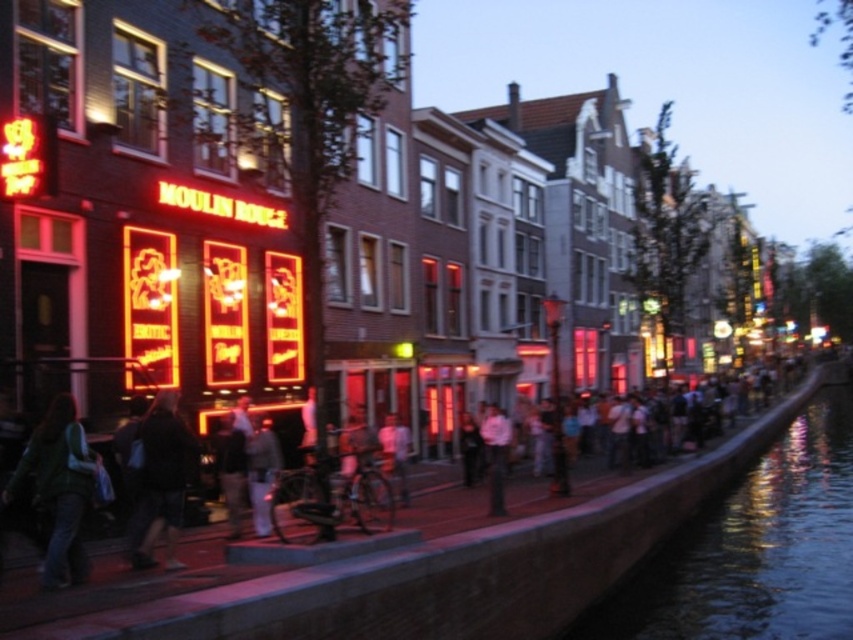
Who is positioned more to the left, dark blue liquid at lower right or dark gray jacket at center?

dark gray jacket at center is more to the left.

Is dark blue liquid at lower right closer to the viewer compared to dark gray jacket at center?

No.

What do you see at coordinates (753, 548) in the screenshot? I see `dark blue liquid at lower right` at bounding box center [753, 548].

Locate an element on the screen. dark blue liquid at lower right is located at coordinates (753, 548).

Can you confirm if dark blue liquid at lower right is taller than green fabric jacket at lower left?

In fact, dark blue liquid at lower right may be shorter than green fabric jacket at lower left.

Which is behind, point (845, 552) or point (61, 563)?

The point (845, 552) is behind.

Is point (740, 570) positioned behind point (54, 586)?

That is True.

What are the coordinates of `dark blue liquid at lower right` in the screenshot? It's located at (753, 548).

Based on the photo, who is more forward, (74, 413) or (177, 502)?

Point (74, 413) is more forward.

Is green fabric jacket at lower left wider than dark gray jacket at center?

A: Indeed, green fabric jacket at lower left has a greater width compared to dark gray jacket at center.

The height and width of the screenshot is (640, 853). Describe the element at coordinates (59, 486) in the screenshot. I see `green fabric jacket at lower left` at that location.

You are a GUI agent. You are given a task and a screenshot of the screen. Output one action in this format:
    pyautogui.click(x=<x>, y=<y>)
    Task: Click on the green fabric jacket at lower left
    Image resolution: width=853 pixels, height=640 pixels.
    Given the screenshot: What is the action you would take?
    pyautogui.click(x=59, y=486)